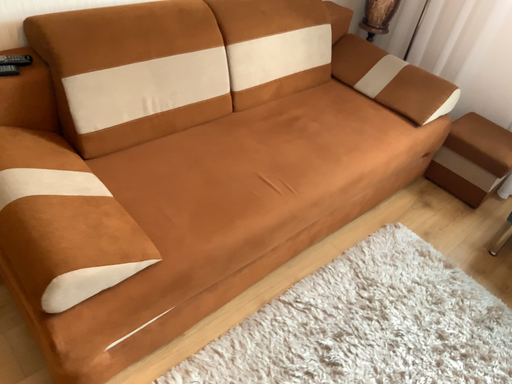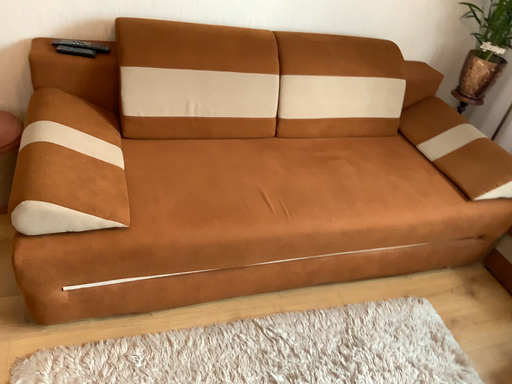
Question: Which way did the camera rotate in the video?

Choices:
 (A) rotated right
 (B) rotated left

Answer: (B)